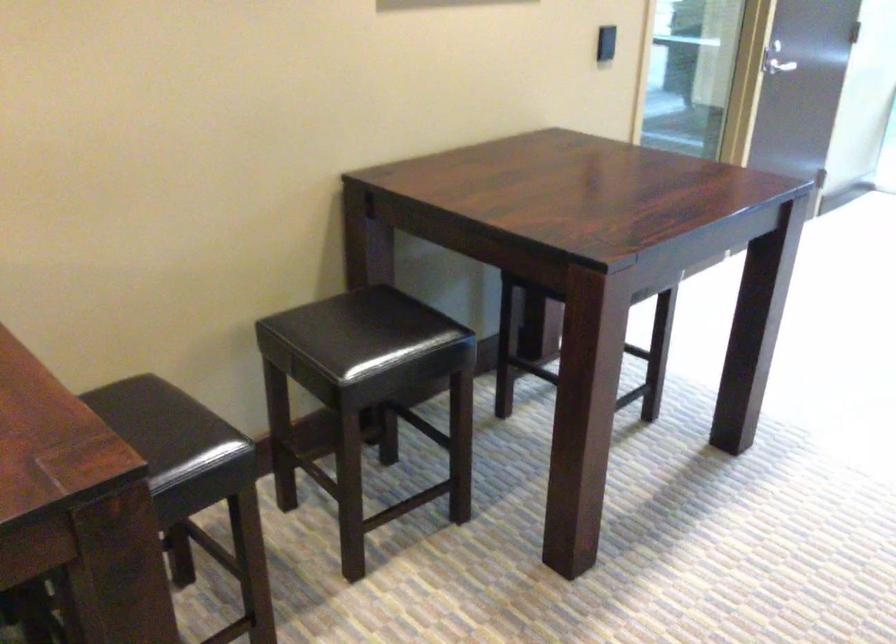
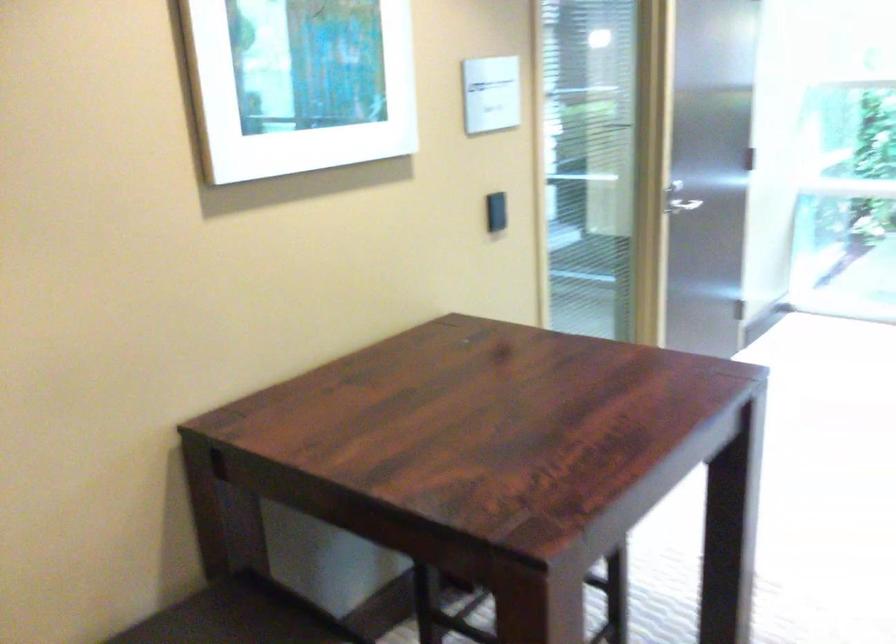
Question: What movement of the cameraman would produce the second image?

Choices:
 (A) Left
 (B) Right
 (C) Forward
 (D) Backward

Answer: (C)